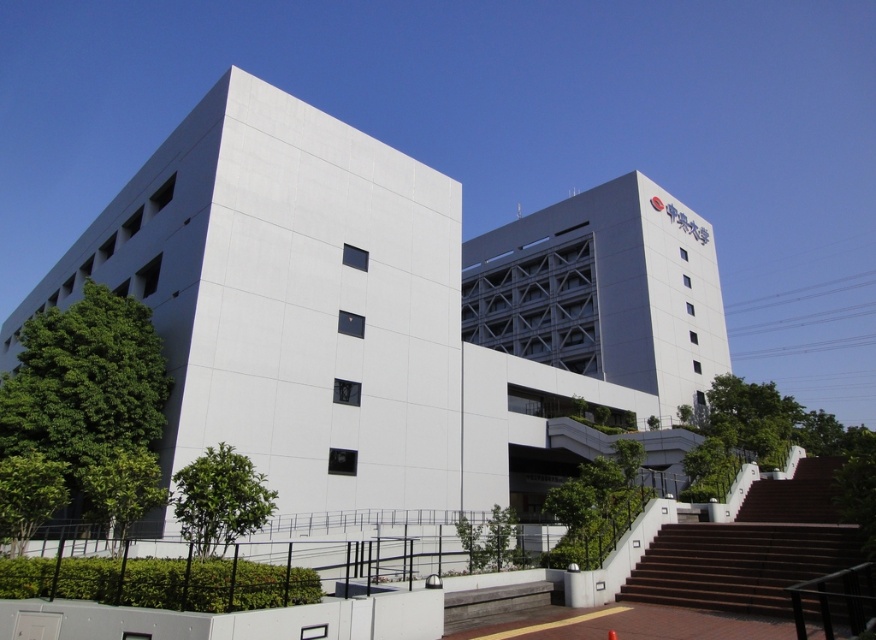
Can you confirm if white matte building at center is taller than brown wooden stairs at lower right?

Correct, white matte building at center is much taller as brown wooden stairs at lower right.

Does white matte building at center have a lesser height compared to brown wooden stairs at lower right?

In fact, white matte building at center may be taller than brown wooden stairs at lower right.

Who is more distant from viewer, (562, 292) or (853, 563)?

The point (562, 292) is behind.

At what (x,y) coordinates should I click in order to perform the action: click on white matte building at center. Please return your answer as a coordinate pair (x, y). Image resolution: width=876 pixels, height=640 pixels. Looking at the image, I should click on (603, 291).

Between white smooth building at center and brown wooden stairs at lower right, which one appears on the left side from the viewer's perspective?

white smooth building at center

Is white smooth building at center shorter than brown wooden stairs at lower right?

No, white smooth building at center is not shorter than brown wooden stairs at lower right.

At what (x,y) coordinates should I click in order to perform the action: click on white smooth building at center. Please return your answer as a coordinate pair (x, y). This screenshot has height=640, width=876. Looking at the image, I should click on [x=394, y=314].

Can you confirm if white smooth building at center is bigger than white matte building at center?

Yes.

Which is above, white smooth building at center or white matte building at center?

white matte building at center is higher up.

Between point (309, 442) and point (573, 284), which one is positioned behind?

Point (573, 284)

Find the location of a particular element. The width and height of the screenshot is (876, 640). white smooth building at center is located at coordinates point(394,314).